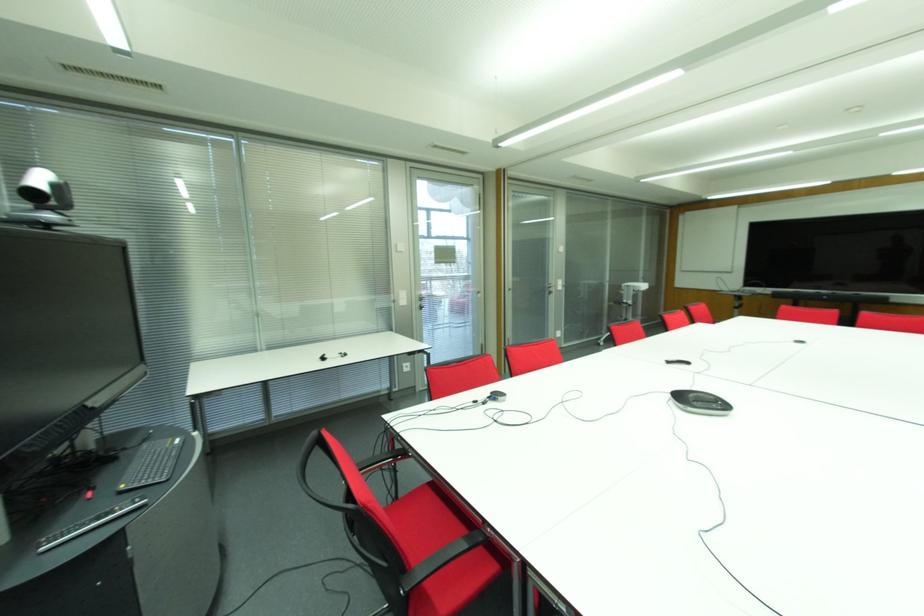
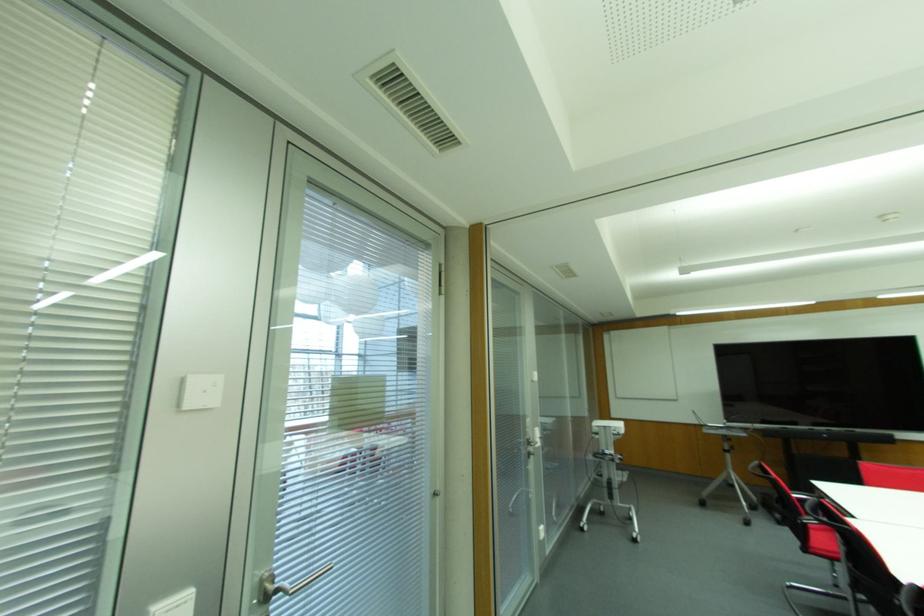
Where in the second image is the point corresponding to (x=599, y=344) from the first image?

(581, 529)